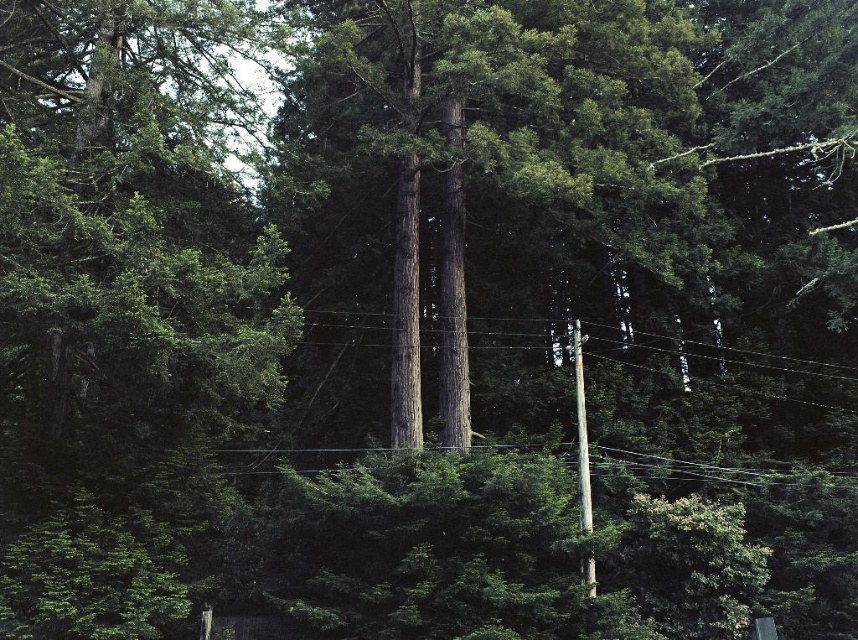
Question: Can you confirm if brown wooden power line at center is thinner than smooth gray wood telegraph pole at center-right?

Choices:
 (A) yes
 (B) no

Answer: (B)

Question: Based on their relative distances, which object is nearer to the brown wooden power line at center?

Choices:
 (A) smooth gray wood telegraph pole at center-right
 (B) black wire at center

Answer: (B)

Question: From the image, what is the correct spatial relationship of brown wooden power line at center in relation to black wire at center?

Choices:
 (A) left
 (B) right

Answer: (B)

Question: Is brown wooden power line at center behind black wire at center?

Choices:
 (A) no
 (B) yes

Answer: (B)

Question: Which point is closer to the camera?

Choices:
 (A) black wire at center
 (B) smooth gray wood telegraph pole at center-right
 (C) brown wooden power line at center

Answer: (B)

Question: Which object appears farthest from the camera in this image?

Choices:
 (A) black wire at center
 (B) smooth gray wood telegraph pole at center-right
 (C) brown wooden power line at center

Answer: (C)